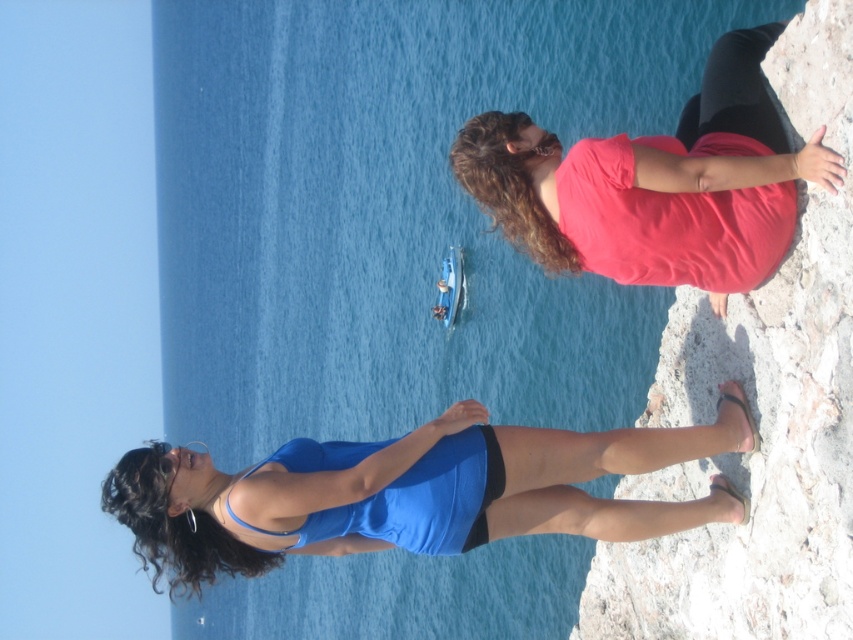
Question: Which point appears closest to the camera in this image?

Choices:
 (A) (300, 545)
 (B) (740, 81)

Answer: (B)

Question: Is matte blue dress at lower center further to the viewer compared to blue matte bikini top at lower center?

Choices:
 (A) yes
 (B) no

Answer: (B)

Question: Is white rough stone at right to the right of matte pink shirt at upper right from the viewer's perspective?

Choices:
 (A) no
 (B) yes

Answer: (B)

Question: Does matte blue dress at lower center have a larger size compared to blue matte bikini top at lower center?

Choices:
 (A) no
 (B) yes

Answer: (B)

Question: Which point is closer to the camera?

Choices:
 (A) white rough stone at right
 (B) matte blue dress at lower center
 (C) blue matte bikini top at lower center
 (D) matte pink shirt at upper right

Answer: (A)

Question: Which object is the closest to the matte blue dress at lower center?

Choices:
 (A) matte pink shirt at upper right
 (B) blue matte bikini top at lower center
 (C) white rough stone at right

Answer: (B)